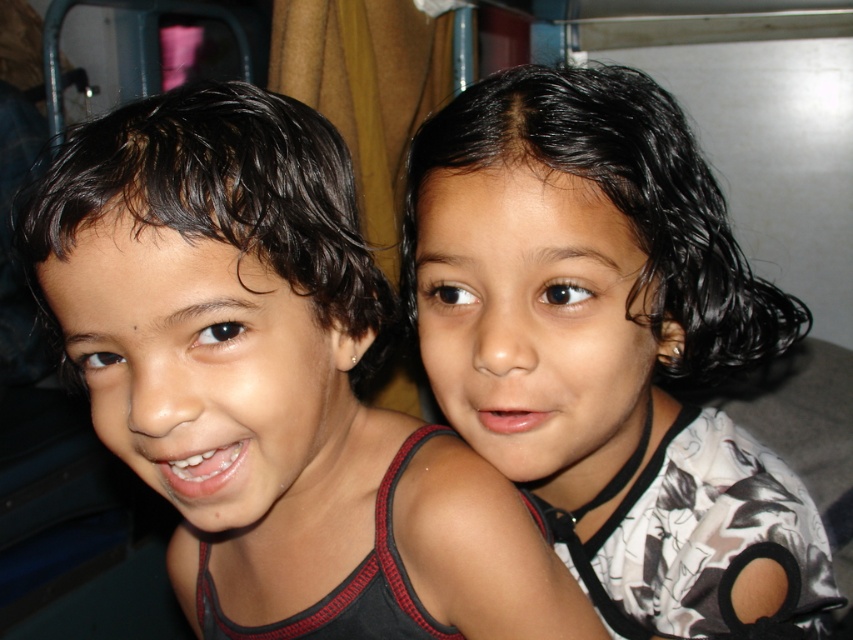
Between matte black tank top at left and black matte hair at upper right, which one appears on the right side from the viewer's perspective?

Positioned to the right is black matte hair at upper right.

Who is shorter, matte black tank top at left or black matte hair at upper right?

matte black tank top at left

Is point (282, 326) less distant than point (432, 237)?

Yes, it is.

Where is `matte black tank top at left`? matte black tank top at left is located at coordinates (271, 384).